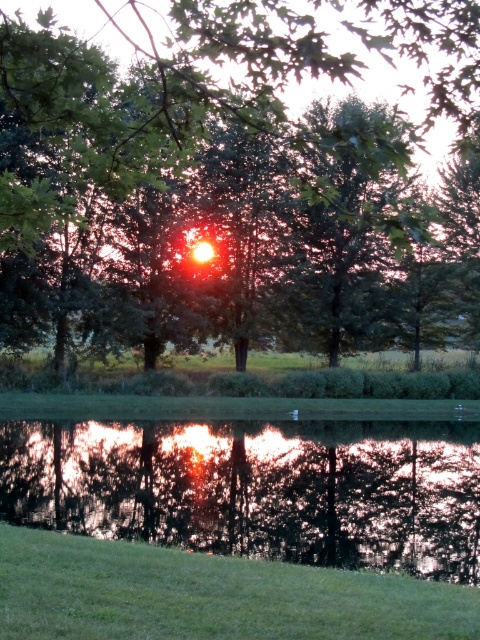
Is green leafy tree at center closer to camera compared to reflective glass water at center?

Yes, it is in front of reflective glass water at center.

The height and width of the screenshot is (640, 480). What do you see at coordinates (237, 179) in the screenshot?
I see `green leafy tree at center` at bounding box center [237, 179].

This screenshot has width=480, height=640. What do you see at coordinates (237, 179) in the screenshot? I see `green leafy tree at center` at bounding box center [237, 179].

Where is `green leafy tree at center`? This screenshot has height=640, width=480. green leafy tree at center is located at coordinates (237, 179).